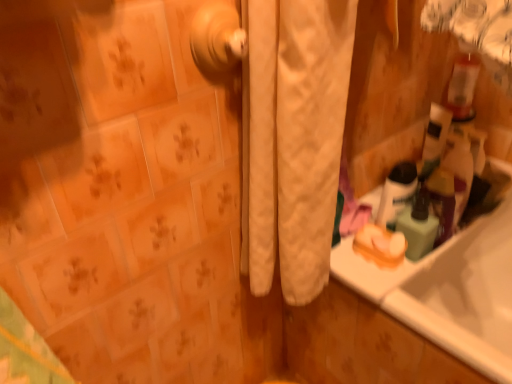
What do you see at coordinates (217, 40) in the screenshot? The width and height of the screenshot is (512, 384). I see `polished brass door handle at center` at bounding box center [217, 40].

In order to click on translucent plastic soap dispenser at right in this screenshot , I will do `click(418, 226)`.

Image resolution: width=512 pixels, height=384 pixels. In order to click on mouthwash that appears on the right of white quilted curtain at center in this screenshot , I will do `click(396, 193)`.

In the scene shown: From the image's perspective, relative to white quilted curtain at center, is white glossy mouthwash at upper right above or below?

From the image's perspective, white glossy mouthwash at upper right appears below white quilted curtain at center.

Measure the distance from white glossy mouthwash at upper right to white quilted curtain at center.

They are 30.68 centimeters apart.

Is white glossy mouthwash at upper right surrounded by translucent plastic soap dispenser at right?

No, white glossy mouthwash at upper right is located outside of translucent plastic soap dispenser at right.

Which is closer to the camera, (426, 233) or (387, 210)?

Clearly, point (426, 233) is closer to the camera than point (387, 210).

Could you measure the distance between translucent plastic soap dispenser at right and white glossy mouthwash at upper right?

4.42 centimeters.

Considering the relative positions of translucent plastic soap dispenser at right and white glossy mouthwash at upper right in the image provided, is translucent plastic soap dispenser at right to the right of white glossy mouthwash at upper right from the viewer's perspective?

Correct, you'll find translucent plastic soap dispenser at right to the right of white glossy mouthwash at upper right.

From a real-world perspective, is translucent plastic soap dispenser at right positioned under white quilted curtain at center based on gravity?

Indeed, from a real-world perspective, translucent plastic soap dispenser at right is positioned beneath white quilted curtain at center.

Identify the location of cleaning product behind the white quilted curtain at center. This screenshot has width=512, height=384. (418, 226).

Considering the sizes of translucent plastic soap dispenser at right and white quilted curtain at center in the image, is translucent plastic soap dispenser at right wider or thinner than white quilted curtain at center?

Result: In the image, translucent plastic soap dispenser at right appears to be more narrow than white quilted curtain at center.

Is translucent plastic soap dispenser at right at the left side of white quilted curtain at center?

No, translucent plastic soap dispenser at right is not to the left of white quilted curtain at center.

Looking at this image, could you tell me if white quilted curtain at center is facing translucent plastic soap dispenser at right?

No.

Who is smaller, white quilted curtain at center or translucent plastic soap dispenser at right?

With smaller size is translucent plastic soap dispenser at right.

Considering the sizes of white quilted curtain at center and translucent plastic soap dispenser at right in the image, is white quilted curtain at center taller or shorter than translucent plastic soap dispenser at right?

Considering their sizes, white quilted curtain at center has more height than translucent plastic soap dispenser at right.

Measure the distance between white quilted curtain at center and translucent plastic soap dispenser at right.

white quilted curtain at center is 13.38 inches from translucent plastic soap dispenser at right.

Looking at this image, is white quilted curtain at center completely or partially outside of polished brass door handle at center?

Absolutely, white quilted curtain at center is external to polished brass door handle at center.

Is white quilted curtain at center to the left of polished brass door handle at center from the viewer's perspective?

No, white quilted curtain at center is not to the left of polished brass door handle at center.

Measure the distance between white quilted curtain at center and polished brass door handle at center.

8.10 inches.

Is translucent plastic soap dispenser at right closer to the viewer compared to polished brass door handle at center?

No, the depth of translucent plastic soap dispenser at right is greater than that of polished brass door handle at center.

Is translucent plastic soap dispenser at right wider than polished brass door handle at center?

Yes, translucent plastic soap dispenser at right is wider than polished brass door handle at center.

Between translucent plastic soap dispenser at right and polished brass door handle at center, which one has smaller size?

With smaller size is polished brass door handle at center.

Does translucent plastic soap dispenser at right contain polished brass door handle at center?

That's incorrect, polished brass door handle at center is not inside translucent plastic soap dispenser at right.

Visually, is white glossy mouthwash at upper right positioned to the left or to the right of polished brass door handle at center?

Based on their positions, white glossy mouthwash at upper right is located to the right of polished brass door handle at center.

Based on their sizes in the image, would you say white glossy mouthwash at upper right is bigger or smaller than polished brass door handle at center?

In the image, white glossy mouthwash at upper right appears to be larger than polished brass door handle at center.

From a real-world perspective, is white glossy mouthwash at upper right above or below polished brass door handle at center?

From a real-world perspective, white glossy mouthwash at upper right is physically below polished brass door handle at center.

Can you see white glossy mouthwash at upper right touching polished brass door handle at center?

They are not placed beside each other.

The image size is (512, 384). I want to click on mouthwash located on the right of white quilted curtain at center, so click(396, 193).

At what (x,y) coordinates should I click in order to perform the action: click on mouthwash located on the left of translucent plastic soap dispenser at right. Please return your answer as a coordinate pair (x, y). The height and width of the screenshot is (384, 512). Looking at the image, I should click on (396, 193).

Looking at this image, when comparing their distances from polished brass door handle at center, does translucent plastic soap dispenser at right or white glossy mouthwash at upper right seem closer?

Based on the image, white glossy mouthwash at upper right appears to be nearer to polished brass door handle at center.

Looking at the image, which one is located further to translucent plastic soap dispenser at right, white quilted curtain at center or polished brass door handle at center?

polished brass door handle at center is further to translucent plastic soap dispenser at right.

In the scene shown: Looking at the image, which one is located closer to white glossy mouthwash at upper right, polished brass door handle at center or white quilted curtain at center?

white quilted curtain at center is positioned closer to the anchor white glossy mouthwash at upper right.

Looking at the image, which one is located closer to polished brass door handle at center, white glossy mouthwash at upper right or translucent plastic soap dispenser at right?

The object closer to polished brass door handle at center is white glossy mouthwash at upper right.

Looking at the image, which one is located further to translucent plastic soap dispenser at right, white glossy mouthwash at upper right or polished brass door handle at center?

polished brass door handle at center is positioned further to the anchor translucent plastic soap dispenser at right.

In the scene shown: Based on their spatial positions, is translucent plastic soap dispenser at right or polished brass door handle at center closer to white glossy mouthwash at upper right?

The object closer to white glossy mouthwash at upper right is translucent plastic soap dispenser at right.

When comparing their distances from polished brass door handle at center, does white glossy mouthwash at upper right or white quilted curtain at center seem closer?

white quilted curtain at center.

Looking at the image, which one is located further to translucent plastic soap dispenser at right, white glossy mouthwash at upper right or white quilted curtain at center?

white quilted curtain at center is positioned further to the anchor translucent plastic soap dispenser at right.

The width and height of the screenshot is (512, 384). I want to click on mouthwash situated between polished brass door handle at center and translucent plastic soap dispenser at right from left to right, so click(x=396, y=193).

The height and width of the screenshot is (384, 512). I want to click on door handle positioned between white quilted curtain at center and white glossy mouthwash at upper right from near to far, so click(x=217, y=40).

I want to click on curtain situated between polished brass door handle at center and translucent plastic soap dispenser at right from left to right, so click(x=293, y=139).

This screenshot has height=384, width=512. In order to click on cleaning product between white quilted curtain at center and white glossy mouthwash at upper right along the z-axis in this screenshot , I will do `click(418, 226)`.